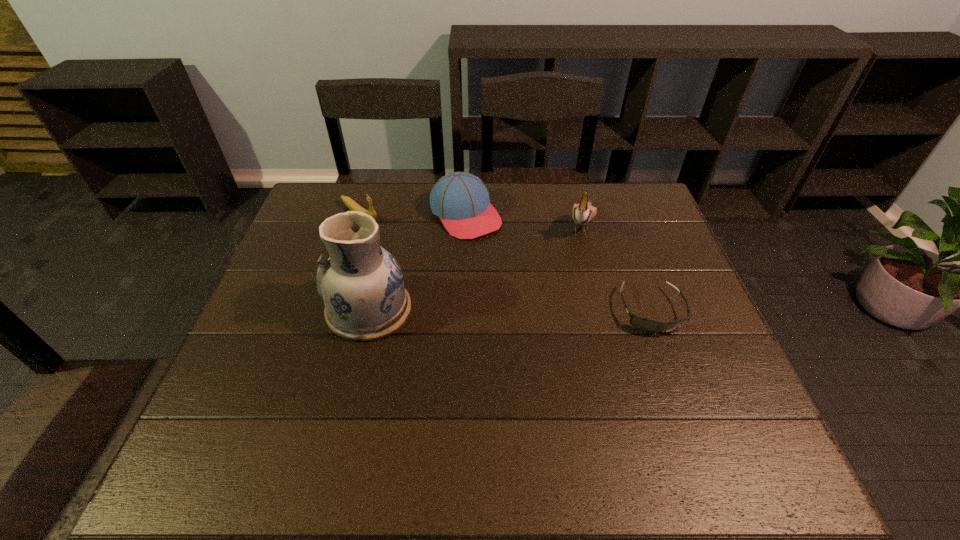
Find the location of a particular element. pottery is located at coordinates (362, 285).

Locate an element on the screen. This screenshot has height=540, width=960. the shortest object is located at coordinates (646, 325).

You are a GUI agent. You are given a task and a screenshot of the screen. Output one action in this format:
    pyautogui.click(x=<x>, y=<y>)
    Task: Click on the bird
    This screenshot has height=540, width=960.
    Given the screenshot: What is the action you would take?
    pyautogui.click(x=583, y=213)

Image resolution: width=960 pixels, height=540 pixels. In order to click on banana in this screenshot , I will do `click(350, 203)`.

Find the location of a particular element. The image size is (960, 540). baseball cap is located at coordinates (461, 200).

In order to click on blank space located on the back of the pottery in this screenshot , I will do `click(386, 235)`.

In order to click on free space located 0.110m on the lenses of the goggles in this screenshot , I will do `click(675, 378)`.

You are a GUI agent. You are given a task and a screenshot of the screen. Output one action in this format:
    pyautogui.click(x=<x>, y=<y>)
    Task: Click on the vacant area situated at the face of the bird
    This screenshot has height=540, width=960.
    Given the screenshot: What is the action you would take?
    pyautogui.click(x=572, y=273)

Locate an element on the screen. free spot located 0.250m at the face of the bird is located at coordinates (562, 306).

The image size is (960, 540). Identify the location of blank area located at the face of the bird. tap(551, 339).